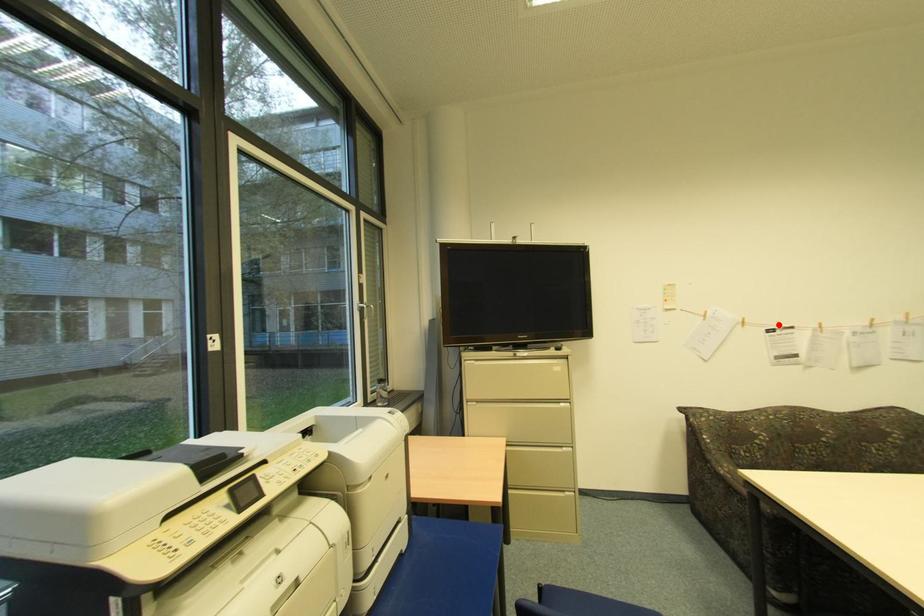
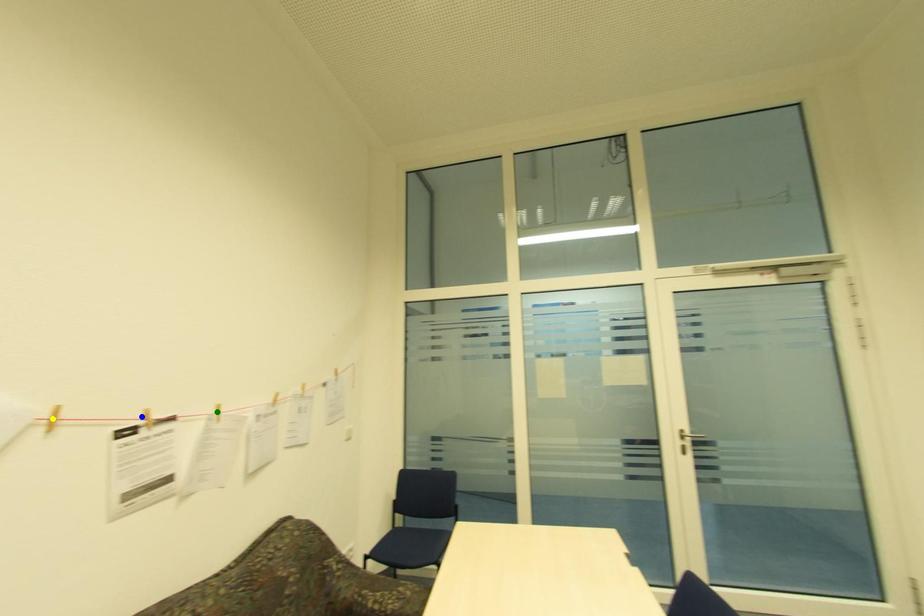
Question: I am providing you with two images of the same scene from different viewpoints. A red point is marked on the first image. You are given multiple points on the second image. Can you choose the point in image 2 that corresponds to the point in image 1?

Choices:
 (A) green point
 (B) blue point
 (C) yellow point

Answer: (B)